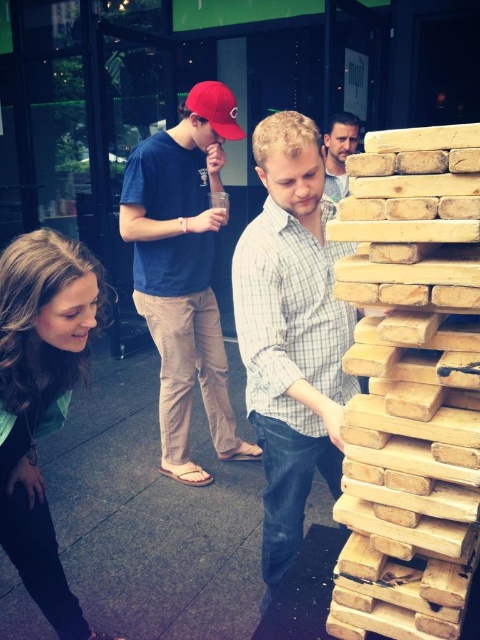
You are a photographer standing in the plaza. You want to take a photo of the natural light wood at center and the smooth light blue shirt at upper center. Based on their positions, which object should you focus on first if you are moving from left to right across the scene?

The natural light wood at center should be focused on first since it is positioned to the left of the smooth light blue shirt at upper center, so when moving from left to right, you encounter it first.

You are a photographer trying to capture a clear shot of the smooth light blue shirt at upper center and the red matte baseball cap at upper left. Since you want to ensure both are visible, which object should you focus on first considering their sizes?

The smooth light blue shirt at upper center is bigger than the red matte baseball cap at upper left, so you should focus on the smooth light blue shirt at upper center first as it occupies more space in the frame.